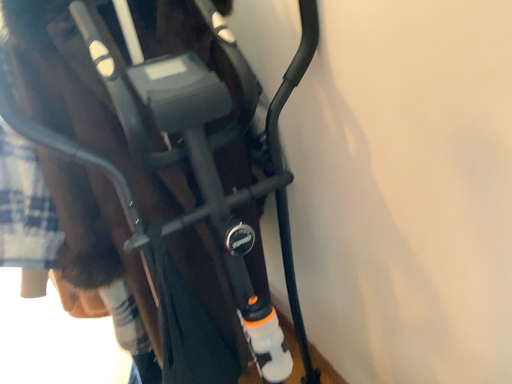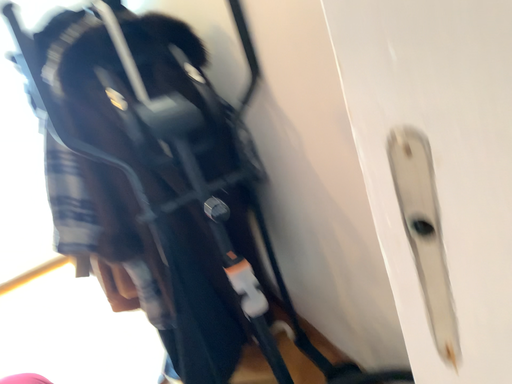
Question: Which way did the camera rotate in the video?

Choices:
 (A) rotated upward
 (B) rotated downward

Answer: (A)